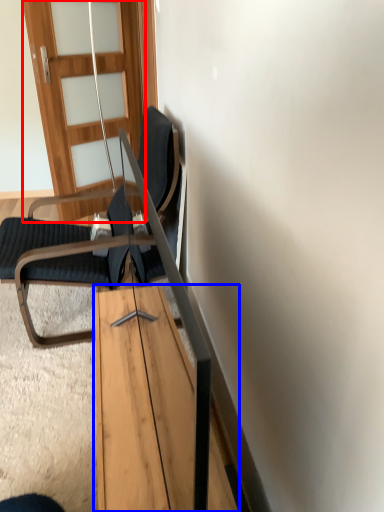
Question: Among these objects, which one is nearest to the camera, door (highlighted by a red box) or table (highlighted by a blue box)?

Choices:
 (A) door
 (B) table

Answer: (B)